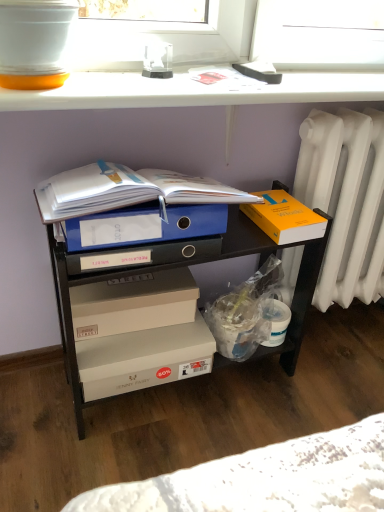
Question: Would you say white glossy window sill at upper center is a long distance from blue plastic file at center?

Choices:
 (A) no
 (B) yes

Answer: (A)

Question: Does white glossy window sill at upper center touch blue plastic file at center?

Choices:
 (A) yes
 (B) no

Answer: (B)

Question: Is white glossy window sill at upper center oriented away from blue plastic file at center?

Choices:
 (A) no
 (B) yes

Answer: (A)

Question: Considering the relative sizes of white glossy window sill at upper center and blue plastic file at center in the image provided, is white glossy window sill at upper center shorter than blue plastic file at center?

Choices:
 (A) no
 (B) yes

Answer: (B)

Question: Considering the relative sizes of white glossy window sill at upper center and blue plastic file at center in the image provided, is white glossy window sill at upper center wider than blue plastic file at center?

Choices:
 (A) yes
 (B) no

Answer: (B)

Question: Does white glossy window sill at upper center have a smaller size compared to blue plastic file at center?

Choices:
 (A) yes
 (B) no

Answer: (A)

Question: Is orange matte book at right, which is the 1th box in top-to-bottom order, facing away from white plastic radiator at right?

Choices:
 (A) no
 (B) yes

Answer: (A)

Question: Does orange matte book at right, the third box positioned from the bottom, appear on the right side of white plastic radiator at right?

Choices:
 (A) no
 (B) yes

Answer: (A)

Question: From the image's perspective, is orange matte book at right, which is the 1th box in top-to-bottom order, below white plastic radiator at right?

Choices:
 (A) yes
 (B) no

Answer: (B)

Question: Considering the relative sizes of orange matte book at right, the third box positioned from the bottom, and white plastic radiator at right in the image provided, is orange matte book at right, the third box positioned from the bottom, smaller than white plastic radiator at right?

Choices:
 (A) no
 (B) yes

Answer: (B)

Question: Is orange matte book at right, which is the 1th box in top-to-bottom order, behind white plastic radiator at right?

Choices:
 (A) no
 (B) yes

Answer: (A)

Question: From a real-world perspective, is orange matte book at right, the third box positioned from the bottom, over white plastic radiator at right?

Choices:
 (A) no
 (B) yes

Answer: (B)

Question: Are beige cardboard box at center, the second box from the top, and white plastic radiator at right beside each other?

Choices:
 (A) no
 (B) yes

Answer: (A)